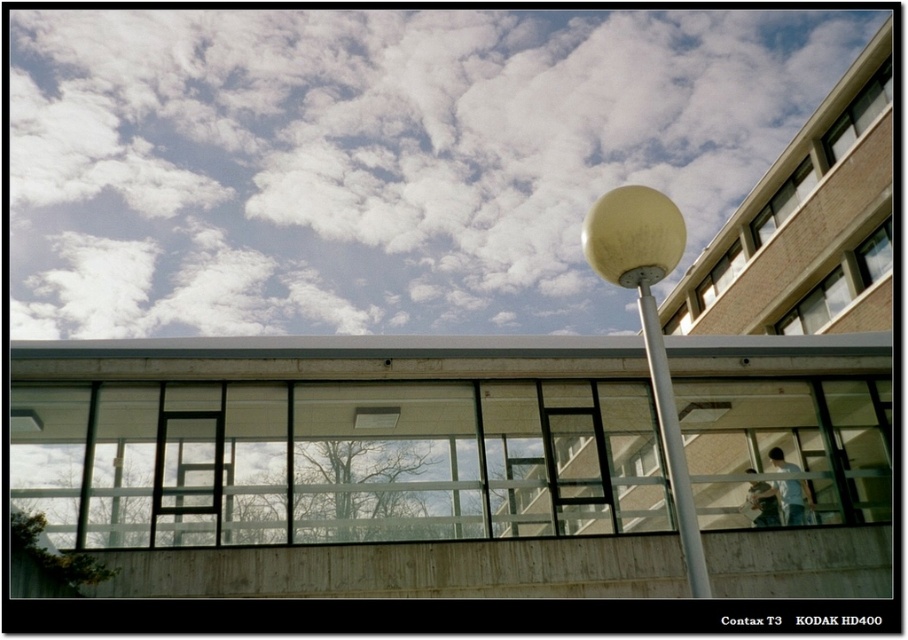
Question: Does metallic silver pole at center appear on the right side of white glossy pole at center?

Choices:
 (A) no
 (B) yes

Answer: (A)

Question: Does wooden ladder at center appear on the right side of white glossy pole at center?

Choices:
 (A) no
 (B) yes

Answer: (A)

Question: Which is farther from the white fluffy cloud at upper center?

Choices:
 (A) white glossy pole at center
 (B) metallic silver pole at center

Answer: (A)

Question: Estimate the real-world distances between objects in this image. Which object is closer to the metallic silver ladder at center?

Choices:
 (A) wooden ladder at center
 (B) white fluffy cloud at upper center

Answer: (A)

Question: Can you confirm if white fluffy cloud at upper center is positioned below metallic silver pole at center?

Choices:
 (A) yes
 (B) no

Answer: (B)

Question: Which point is farther from the camera taking this photo?

Choices:
 (A) (94, 35)
 (B) (574, 408)

Answer: (A)